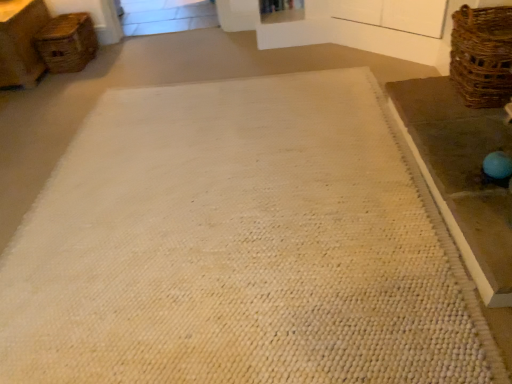
Question: In the image, is brown woven table at right on the left side or the right side of brown woven basket at right, arranged as the 2th basket when viewed from the left?

Choices:
 (A) right
 (B) left

Answer: (B)

Question: Is brown woven table at right in front of or behind brown woven basket at right, positioned as the 1th basket in bottom-to-top order, in the image?

Choices:
 (A) front
 (B) behind

Answer: (A)

Question: Based on their relative distances, which object is nearer to the woven brown basket at upper left, placed as the 1th basket when sorted from left to right?

Choices:
 (A) wooden shelf at upper center
 (B) brown woven basket at right, positioned as the 1th basket in bottom-to-top order
 (C) brown woven table at right

Answer: (A)

Question: Considering the real-world distances, which object is closest to the brown woven basket at right, which is the 2th basket in back-to-front order?

Choices:
 (A) woven brown basket at upper left, which appears as the 1th basket when viewed from the top
 (B) brown woven table at right
 (C) wooden shelf at upper center

Answer: (B)